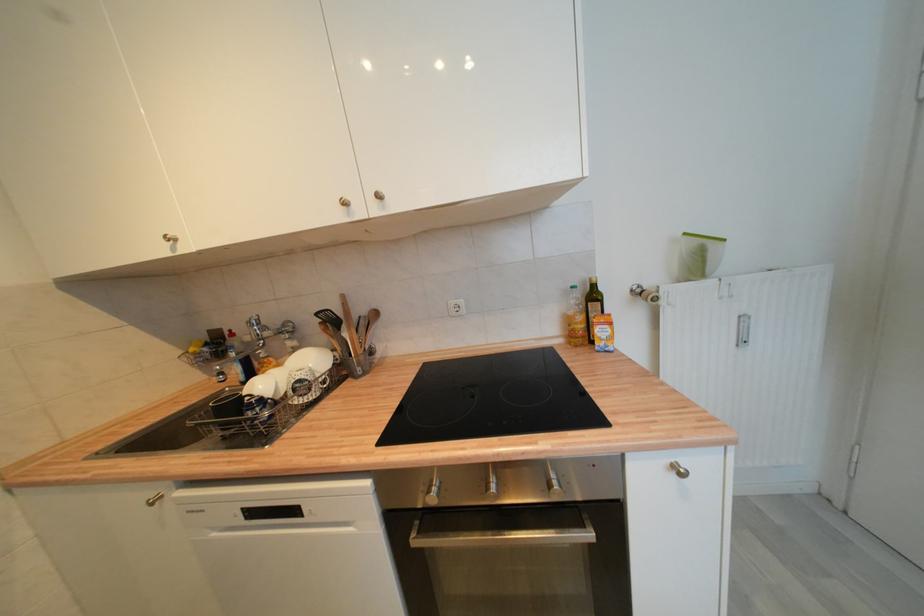
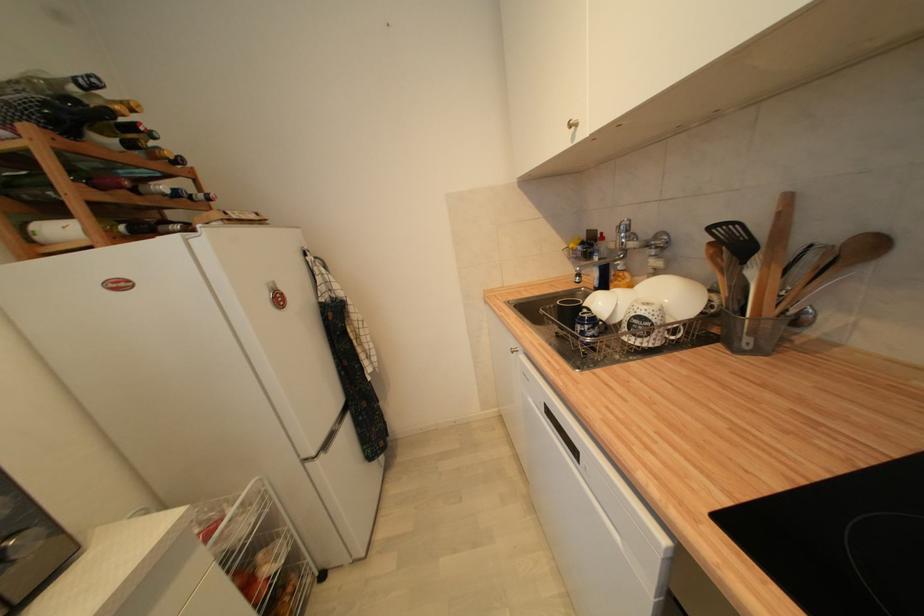
Where in the second image is the point corresponding to [299,513] from the first image?

(578, 453)